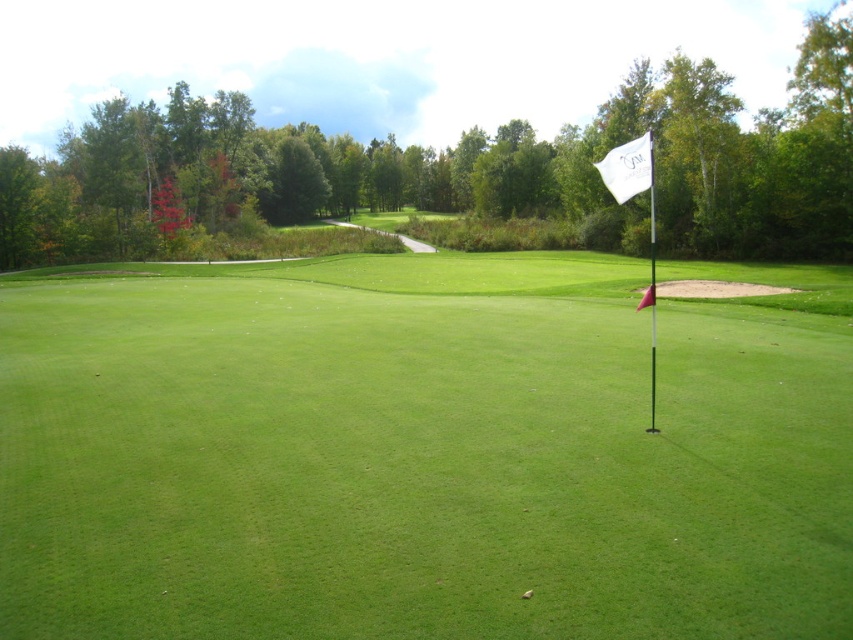
Question: Does white flag at right have a smaller size compared to white fabric flag at upper right?

Choices:
 (A) no
 (B) yes

Answer: (B)

Question: Which point is closer to the camera?

Choices:
 (A) pos(640,164)
 (B) pos(115,308)

Answer: (A)

Question: Among these points, which one is nearest to the camera?

Choices:
 (A) (608, 189)
 (B) (195, 296)

Answer: (A)

Question: From the image, what is the correct spatial relationship of white flag at right in relation to white fabric flag at upper right?

Choices:
 (A) above
 (B) below

Answer: (B)

Question: From the image, what is the correct spatial relationship of white flag at right in relation to white fabric flag at upper right?

Choices:
 (A) above
 (B) below

Answer: (B)

Question: Which point is closer to the camera?

Choices:
 (A) white flag at right
 (B) white fabric flag at upper right

Answer: (A)